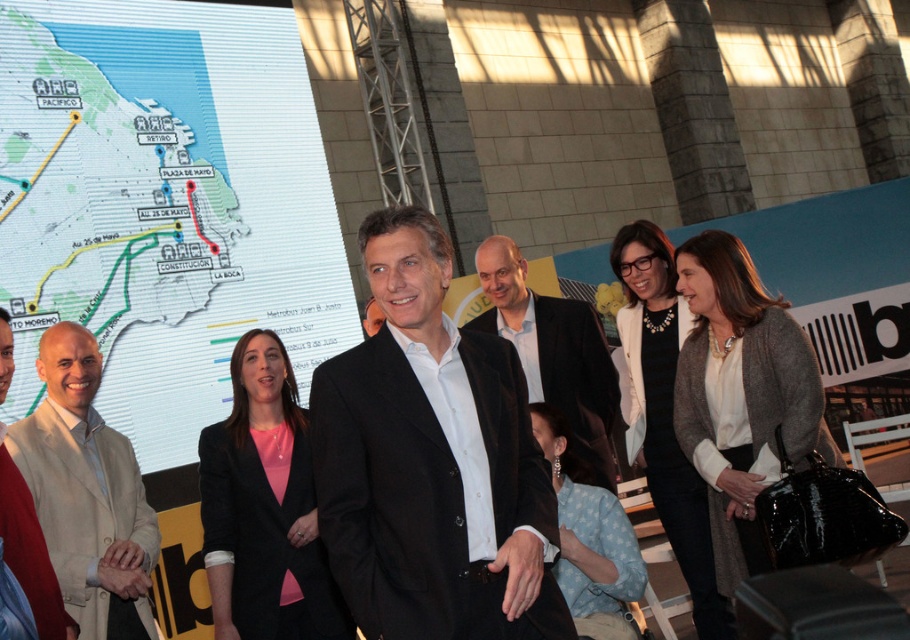
Based on the photo, you are a photographer at the event and need to ensure that both the black glossy suit at center and the velvet black suit at center are clearly visible in the photo. Given their spatial relationship, which one might require more careful framing to avoid being overshadowed?

The black glossy suit at center occupies less space than the velvet black suit at center, so it might require more careful framing to avoid being overshadowed by the larger velvet black suit at center.

You are a photographer adjusting your camera settings. You notice two key figures in the scene wearing a beige fabric jacket at left and a matte black blazer at center. Which of these two items is positioned higher in the image?

The beige fabric jacket at left is located above the matte black blazer at center, so it is positioned higher in the image.